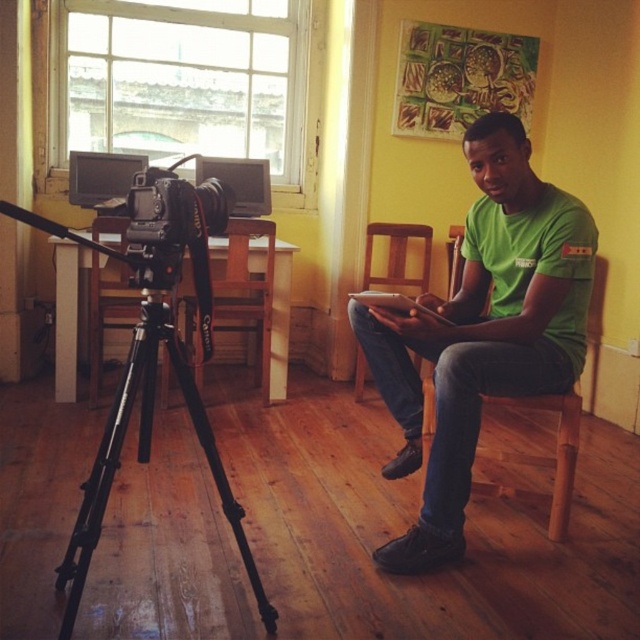
Which is below, black metallic tripod at lower left or black wood chair at left?

black metallic tripod at lower left is below.

Is black metallic tripod at lower left further to camera compared to black wood chair at left?

No, it is not.

Measure the distance between black metallic tripod at lower left and camera.

black metallic tripod at lower left is 4.71 feet away from camera.

I want to click on black metallic tripod at lower left, so click(147, 454).

Can you confirm if wooden chair at right is positioned to the right of wooden at right?

Yes, wooden chair at right is to the right of wooden at right.

In the scene shown: Which is above, wooden chair at right or wooden at right?

wooden at right is higher up.

You are a GUI agent. You are given a task and a screenshot of the screen. Output one action in this format:
    pyautogui.click(x=<x>, y=<y>)
    Task: Click on the wooden chair at right
    This screenshot has height=640, width=640.
    Given the screenshot: What is the action you would take?
    pyautogui.click(x=541, y=456)

Which is above, black metallic tripod at lower left or wooden chair at center?

wooden chair at center is above.

Can you confirm if black metallic tripod at lower left is taller than wooden chair at center?

No.

Does point (138, 346) come behind point (244, 269)?

That is False.

You are a GUI agent. You are given a task and a screenshot of the screen. Output one action in this format:
    pyautogui.click(x=<x>, y=<y>)
    Task: Click on the black metallic tripod at lower left
    The height and width of the screenshot is (640, 640).
    Given the screenshot: What is the action you would take?
    click(x=147, y=454)